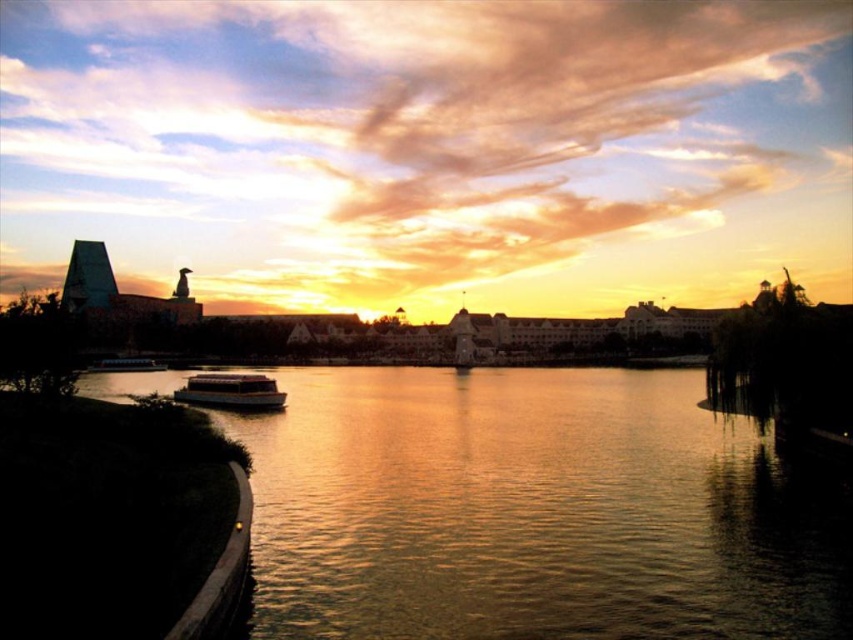
Question: Which of these objects is positioned closest to the white glossy boat at left?

Choices:
 (A) golden reflective water at center
 (B) metallic silver boat at center-left

Answer: (B)

Question: Does golden reflective water at center come behind white glossy boat at left?

Choices:
 (A) yes
 (B) no

Answer: (B)

Question: Which object is the closest to the golden reflective water at center?

Choices:
 (A) white glossy boat at left
 (B) metallic silver boat at center-left

Answer: (B)

Question: Is golden reflective water at center to the left of white glossy boat at left from the viewer's perspective?

Choices:
 (A) yes
 (B) no

Answer: (B)

Question: Does golden reflective water at center have a lesser width compared to metallic silver boat at center-left?

Choices:
 (A) no
 (B) yes

Answer: (A)

Question: Which object is positioned farthest from the white glossy boat at left?

Choices:
 (A) metallic silver boat at center-left
 (B) golden reflective water at center

Answer: (B)